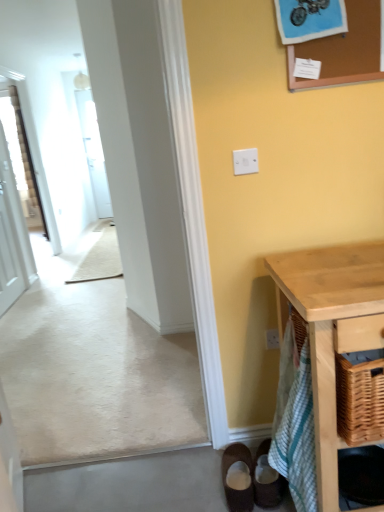
Question: Considering the relative sizes of corkboard at upper right and light wood table at lower right in the image provided, is corkboard at upper right thinner than light wood table at lower right?

Choices:
 (A) yes
 (B) no

Answer: (A)

Question: From the image's perspective, is corkboard at upper right located above light wood table at lower right?

Choices:
 (A) yes
 (B) no

Answer: (A)

Question: From a real-world perspective, is corkboard at upper right beneath light wood table at lower right?

Choices:
 (A) yes
 (B) no

Answer: (B)

Question: Does corkboard at upper right have a lesser height compared to light wood table at lower right?

Choices:
 (A) no
 (B) yes

Answer: (B)

Question: Is light wood table at lower right completely or partially inside corkboard at upper right?

Choices:
 (A) no
 (B) yes

Answer: (A)

Question: Looking at their shapes, would you say white glossy door at left is wider or thinner than brown suede shoes at lower center, marked as the first footwear in a left-to-right arrangement?

Choices:
 (A) wide
 (B) thin

Answer: (B)

Question: Considering the positions of white glossy door at left and brown suede shoes at lower center, marked as the first footwear in a left-to-right arrangement, in the image, is white glossy door at left bigger or smaller than brown suede shoes at lower center, marked as the first footwear in a left-to-right arrangement,?

Choices:
 (A) big
 (B) small

Answer: (A)

Question: From a real-world perspective, is white glossy door at left physically located above or below brown suede shoes at lower center, marked as the first footwear in a left-to-right arrangement?

Choices:
 (A) above
 (B) below

Answer: (A)

Question: Would you say white glossy door at left is inside or outside brown suede shoes at lower center, the second footwear positioned from the right?

Choices:
 (A) outside
 (B) inside

Answer: (A)

Question: Looking at the image, does brown suede shoes at lower center, marked as the first footwear in a left-to-right arrangement, seem bigger or smaller compared to corkboard at upper right?

Choices:
 (A) small
 (B) big

Answer: (B)

Question: Visually, is brown suede shoes at lower center, the second footwear positioned from the right, positioned to the left or to the right of corkboard at upper right?

Choices:
 (A) left
 (B) right

Answer: (A)

Question: In terms of height, does brown suede shoes at lower center, marked as the first footwear in a left-to-right arrangement, look taller or shorter compared to corkboard at upper right?

Choices:
 (A) short
 (B) tall

Answer: (A)

Question: Does point (238, 459) appear closer or farther from the camera than point (294, 52)?

Choices:
 (A) closer
 (B) farther

Answer: (B)

Question: Considering the positions of green striped cloth at lower right and brown suede shoes at lower center, the second footwear positioned from the right, in the image, is green striped cloth at lower right wider or thinner than brown suede shoes at lower center, the second footwear positioned from the right,?

Choices:
 (A) wide
 (B) thin

Answer: (B)

Question: Looking at the image, does green striped cloth at lower right seem bigger or smaller compared to brown suede shoes at lower center, the second footwear positioned from the right?

Choices:
 (A) big
 (B) small

Answer: (A)